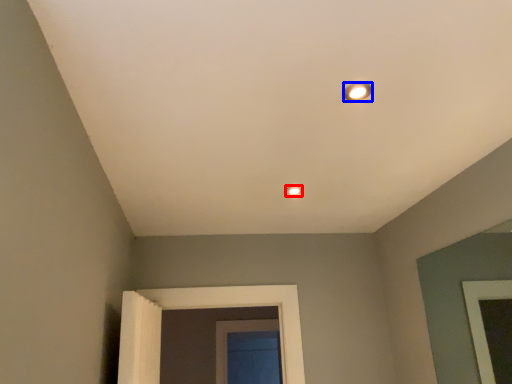
Question: Which of the following is the closest to the observer, lamp (highlighted by a red box) or light (highlighted by a blue box)?

Choices:
 (A) lamp
 (B) light

Answer: (B)